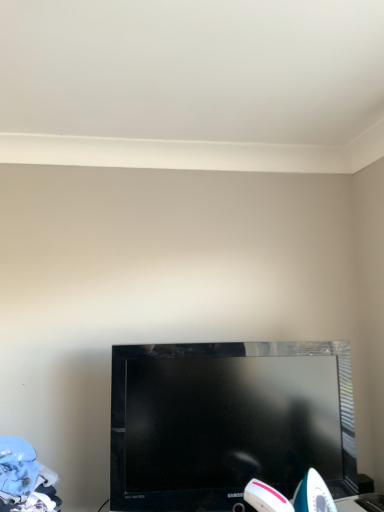
In order to face black glossy tv at center, should I rotate leftwards or rightwards?

You should look right and rotate roughly 5.393 degrees.

Image resolution: width=384 pixels, height=512 pixels. Describe the element at coordinates (228, 422) in the screenshot. I see `black glossy tv at center` at that location.

The width and height of the screenshot is (384, 512). I want to click on black glossy tv at center, so click(x=228, y=422).

At what (x,y) coordinates should I click in order to perform the action: click on black glossy tv at center. Please return your answer as a coordinate pair (x, y). This screenshot has width=384, height=512. Looking at the image, I should click on (228, 422).